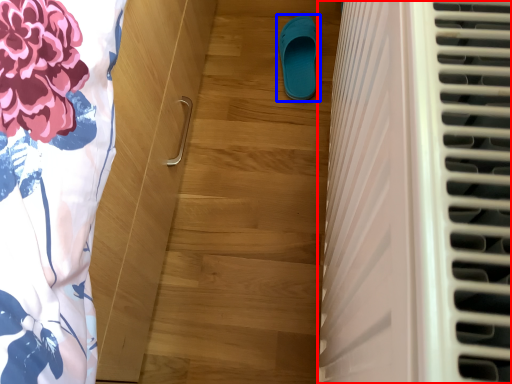
Question: Which object is further to the camera taking this photo, air conditioning (highlighted by a red box) or footwear (highlighted by a blue box)?

Choices:
 (A) air conditioning
 (B) footwear

Answer: (B)